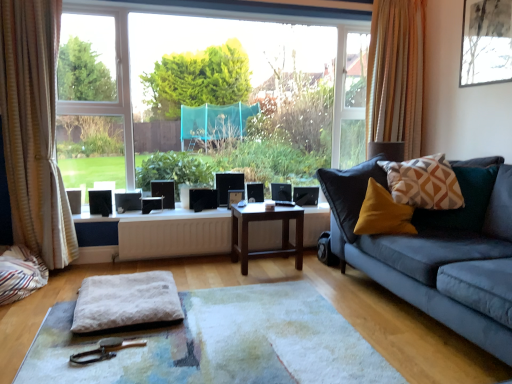
Question: From a real-world perspective, is beige textured curtain at right, which is the second curtain in left-to-right order, on white soft cushion at center?

Choices:
 (A) no
 (B) yes

Answer: (B)

Question: Does beige textured curtain at right, which is the second curtain in left-to-right order, touch white soft cushion at center?

Choices:
 (A) no
 (B) yes

Answer: (A)

Question: Does beige textured curtain at right, which is the first curtain in right-to-left order, appear on the right side of white soft cushion at center?

Choices:
 (A) yes
 (B) no

Answer: (A)

Question: Is white soft cushion at center inside beige textured curtain at right, which is the first curtain in right-to-left order?

Choices:
 (A) yes
 (B) no

Answer: (B)

Question: From the image's perspective, does beige textured curtain at right, which is the second curtain in left-to-right order, appear lower than white soft cushion at center?

Choices:
 (A) yes
 (B) no

Answer: (B)

Question: Considering the relative positions of matte black picture frame at center, which ranks as the first picture frame in left-to-right order, and white fluffy footrest at center in the image provided, is matte black picture frame at center, which ranks as the first picture frame in left-to-right order, to the left or to the right of white fluffy footrest at center?

Choices:
 (A) left
 (B) right

Answer: (B)

Question: Is matte black picture frame at center, which appears as the first picture frame when ordered from the bottom, in front of or behind white fluffy footrest at center in the image?

Choices:
 (A) behind
 (B) front

Answer: (A)

Question: Is point (228, 193) closer or farther from the camera than point (158, 273)?

Choices:
 (A) closer
 (B) farther

Answer: (B)

Question: Is matte black picture frame at center, the 2th picture frame when ordered from top to bottom, spatially inside white fluffy footrest at center, or outside of it?

Choices:
 (A) inside
 (B) outside

Answer: (B)

Question: In terms of width, does geometric-patterned fabric pillow at right look wider or thinner when compared to white striped curtain at left, acting as the second curtain starting from the back?

Choices:
 (A) thin
 (B) wide

Answer: (B)

Question: Considering the positions of geometric-patterned fabric pillow at right and white striped curtain at left, which appears as the 1th curtain when viewed from the left, in the image, is geometric-patterned fabric pillow at right bigger or smaller than white striped curtain at left, which appears as the 1th curtain when viewed from the left,?

Choices:
 (A) big
 (B) small

Answer: (B)

Question: Is geometric-patterned fabric pillow at right inside the boundaries of white striped curtain at left, the first curtain positioned from the front, or outside?

Choices:
 (A) outside
 (B) inside

Answer: (A)

Question: Relative to white striped curtain at left, arranged as the 2th curtain when viewed from the right, is geometric-patterned fabric pillow at right in front or behind?

Choices:
 (A) behind
 (B) front

Answer: (B)

Question: Considering the positions of point (496, 69) and point (22, 39), is point (496, 69) closer or farther from the camera than point (22, 39)?

Choices:
 (A) closer
 (B) farther

Answer: (B)

Question: Looking at their shapes, would you say matte black picture frame at upper right, acting as the 2th picture frame starting from the back, is wider or thinner than white striped curtain at left, acting as the second curtain starting from the back?

Choices:
 (A) thin
 (B) wide

Answer: (A)